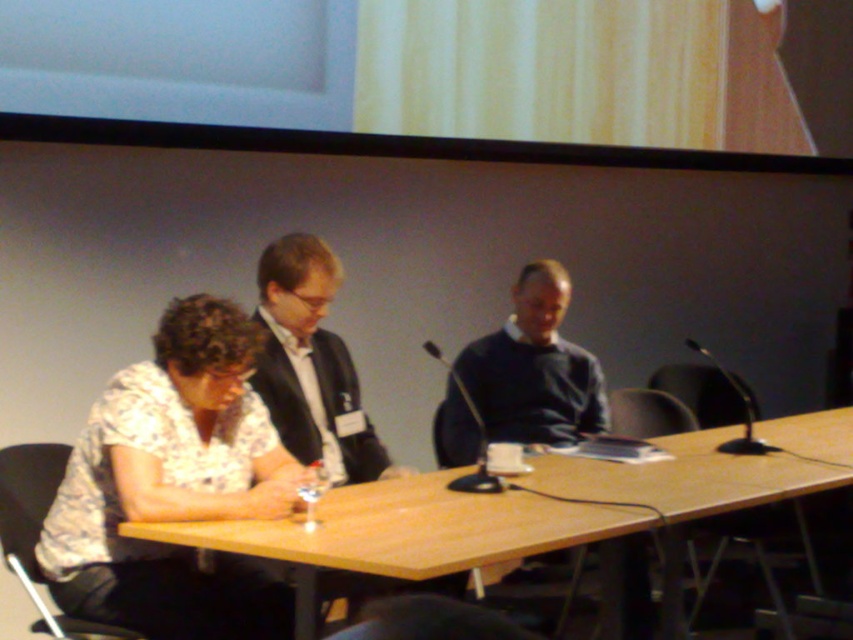
You are standing in front of the meeting table and want to place a small plant between the two points marked as point (207, 337) and point (779, 490). Which point is closer to you where you should place the plant?

Point (207, 337) is closer to the camera than point (779, 490), so you should place the plant closer to point (207, 337) since it is nearer to your position in front of the table.

You are standing in front of the table and want to place a small object on the table. You have two options for placement based on the coordinates given. Which coordinate point, point (109, 588) or point (724, 442), is closer to you?

Point (109, 588) is closer to the viewer than point (724, 442), so you should choose that coordinate point.